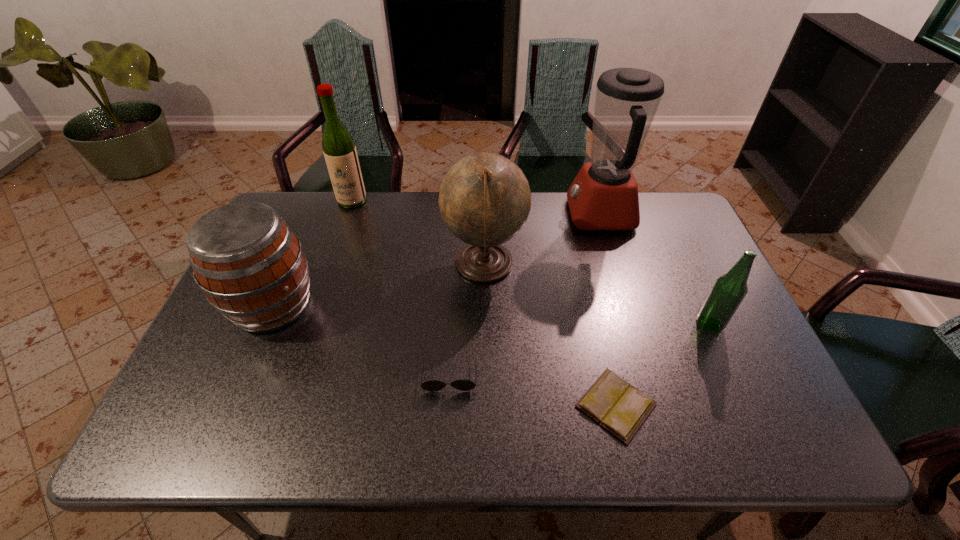
The image size is (960, 540). Identify the location of vacant area between the rightmost object and the liquor. (531, 262).

Identify which object is located as the sixth nearest to the sunglasses. Please provide its 2D coordinates. Your answer should be formatted as a tuple, i.e. [(x, y)], where the tuple contains the x and y coordinates of a point satisfying the conditions above.

[(339, 149)]

This screenshot has height=540, width=960. Find the location of `object that is the closest to the rightmost object`. object that is the closest to the rightmost object is located at coordinates (620, 408).

Locate an element on the screen. The width and height of the screenshot is (960, 540). free location that satisfies the following two spatial constraints: 1. on the front-facing side of the sunglasses; 2. on the right side of the shortest object is located at coordinates (448, 405).

Identify the location of vacant space that satisfies the following two spatial constraints: 1. on the front of the blender near the controls; 2. on the front-facing side of the sunglasses. (649, 374).

Image resolution: width=960 pixels, height=540 pixels. Find the location of `free space in the image that satisfies the following two spatial constraints: 1. on the front-facing side of the diary; 2. on the left side of the second shortest object`. free space in the image that satisfies the following two spatial constraints: 1. on the front-facing side of the diary; 2. on the left side of the second shortest object is located at coordinates pos(448,405).